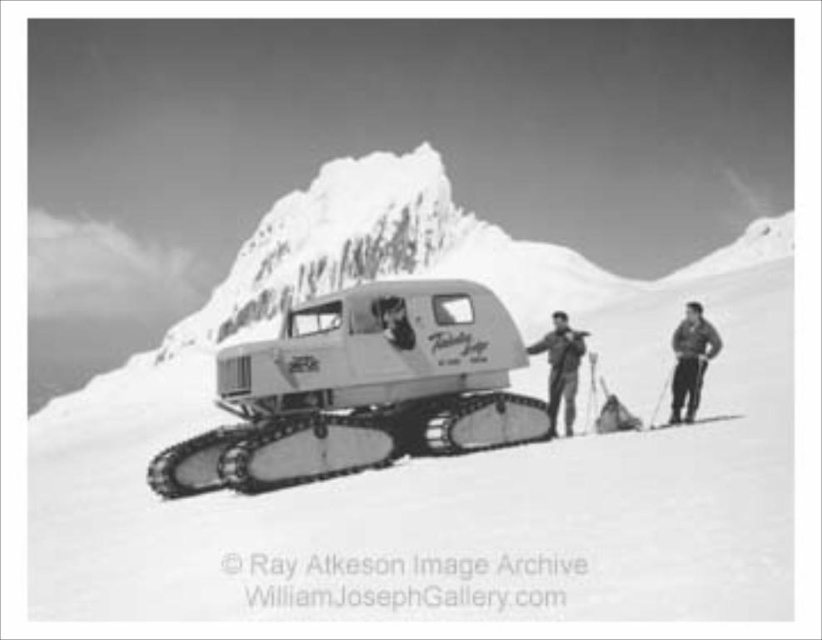
Which is more to the left, metallic silver tracked vehicle at center or dark gray fabric jacket at right?

From the viewer's perspective, metallic silver tracked vehicle at center appears more on the left side.

Is metallic silver tracked vehicle at center below dark gray fabric jacket at right?

Yes.

Image resolution: width=822 pixels, height=640 pixels. Find the location of `metallic silver tracked vehicle at center`. metallic silver tracked vehicle at center is located at coordinates (359, 392).

I want to click on metallic silver tracked vehicle at center, so click(x=359, y=392).

Which is behind, point (543, 504) or point (576, 337)?

Point (576, 337)

Can you confirm if white matte snow at center is positioned to the right of dark gray fabric jacket at center?

No, white matte snow at center is not to the right of dark gray fabric jacket at center.

What are the coordinates of `white matte snow at center` in the screenshot? It's located at (439, 460).

Does snowy white mountain at center have a smaller size compared to dark gray fabric jacket at center?

No.

Is snowy white mountain at center taller than dark gray fabric jacket at center?

Indeed, snowy white mountain at center has a greater height compared to dark gray fabric jacket at center.

Is point (516, 275) farther from viewer compared to point (547, 353)?

That is True.

Locate an element on the screen. Image resolution: width=822 pixels, height=640 pixels. snowy white mountain at center is located at coordinates (381, 252).